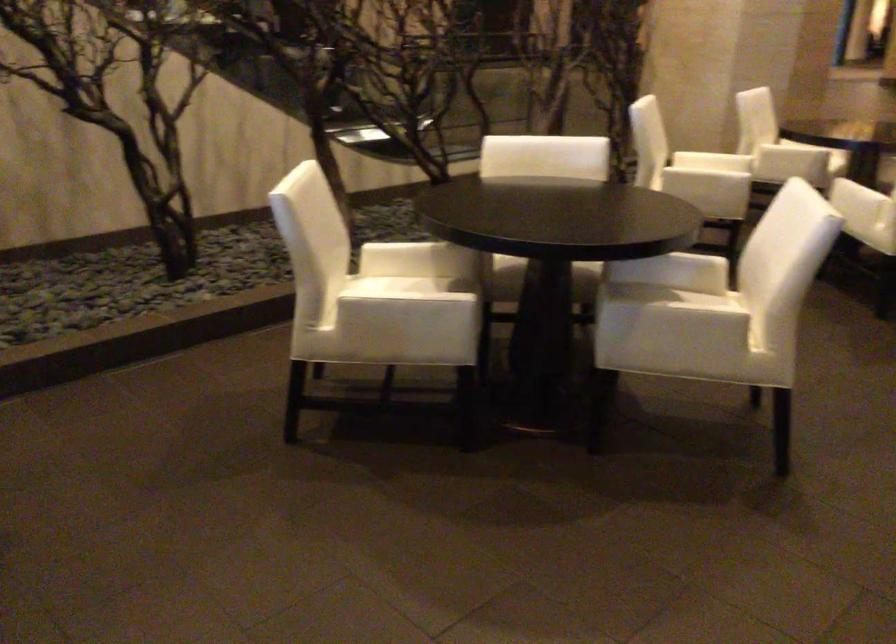
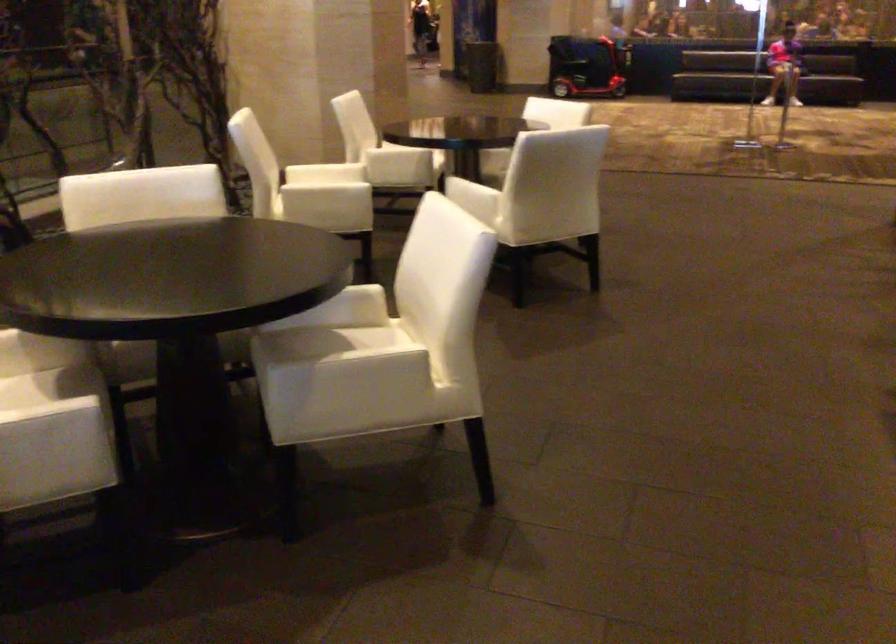
Question: Based on the continuous images, in which direction is the camera rotating? Reply with the corresponding letter.

Choices:
 (A) Left
 (B) Right
 (C) Up
 (D) Down

Answer: (B)